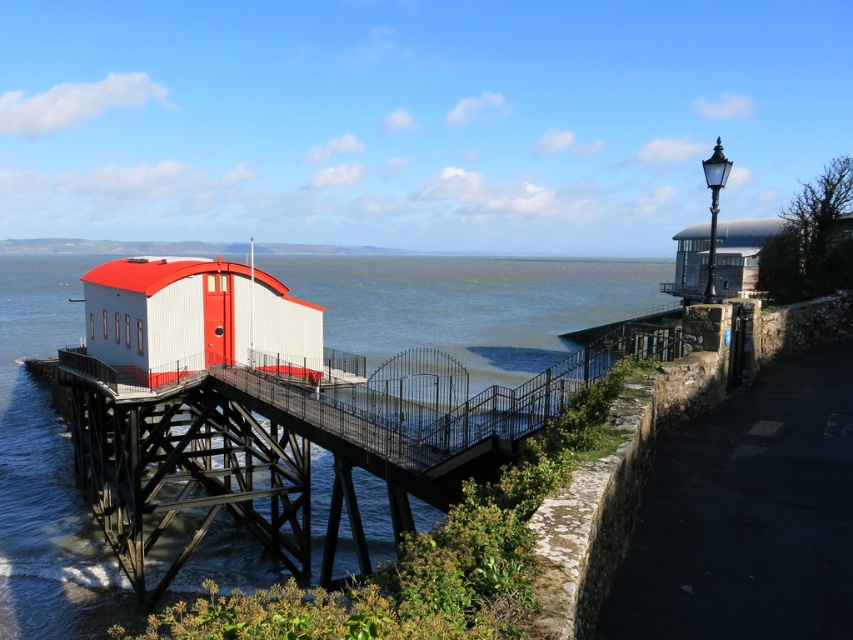
Question: Which object is positioned closest to the white matte bridge at center?

Choices:
 (A) matte white and red beach hut at center
 (B) metallic silver building at upper right

Answer: (A)

Question: Can you confirm if matte white and red beach hut at center is wider than metallic silver building at upper right?

Choices:
 (A) no
 (B) yes

Answer: (A)

Question: Which of the following is the farthest from the observer?

Choices:
 (A) (782, 221)
 (B) (293, 493)

Answer: (A)

Question: Which of the following is the closest to the observer?

Choices:
 (A) metallic silver building at upper right
 (B) matte white and red beach hut at center
 (C) white matte bridge at center

Answer: (C)

Question: Does matte white and red beach hut at center have a smaller size compared to metallic silver building at upper right?

Choices:
 (A) yes
 (B) no

Answer: (A)

Question: Can you confirm if white matte bridge at center is positioned to the right of matte white and red beach hut at center?

Choices:
 (A) no
 (B) yes

Answer: (B)